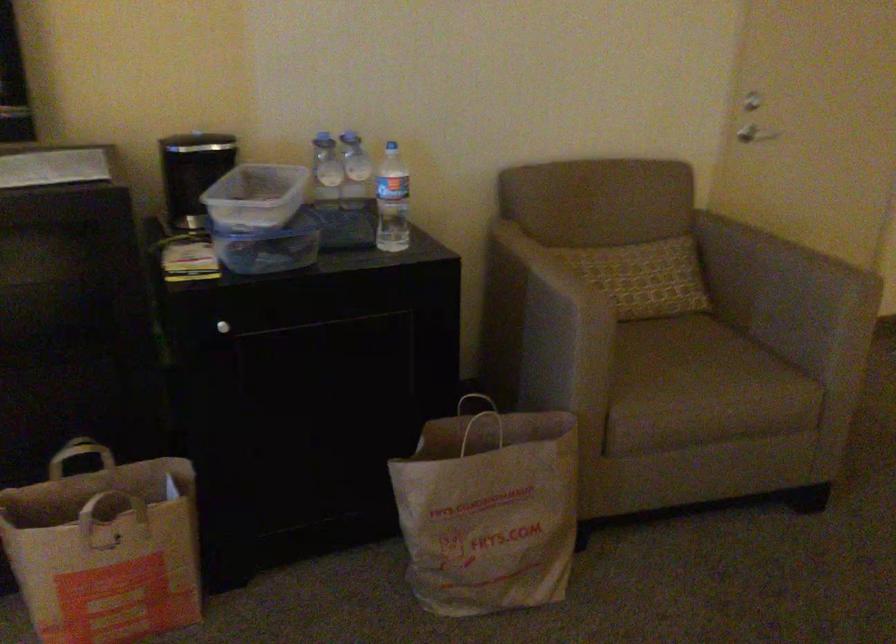
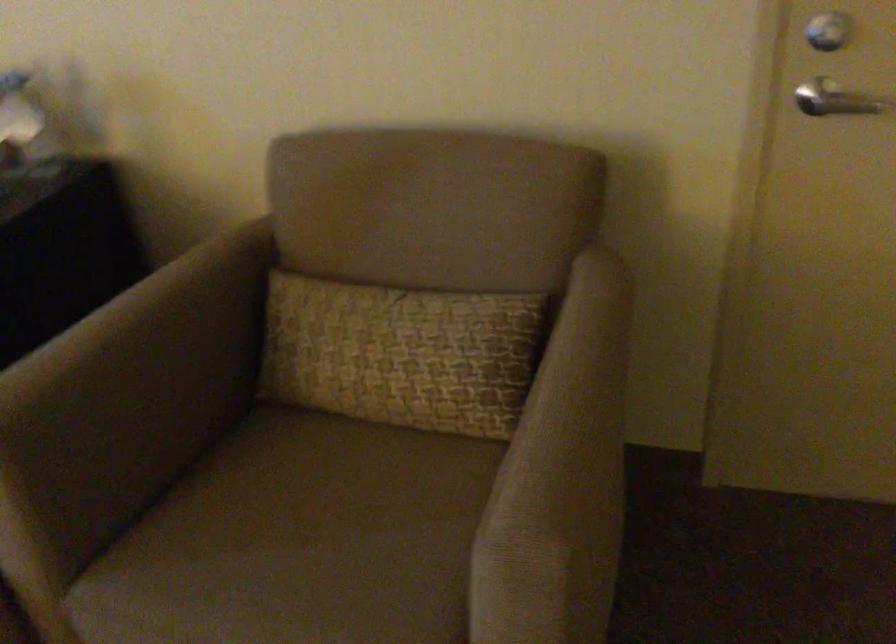
Find the pixel in the second image that matches the point at 575,298 in the first image.

(135, 389)